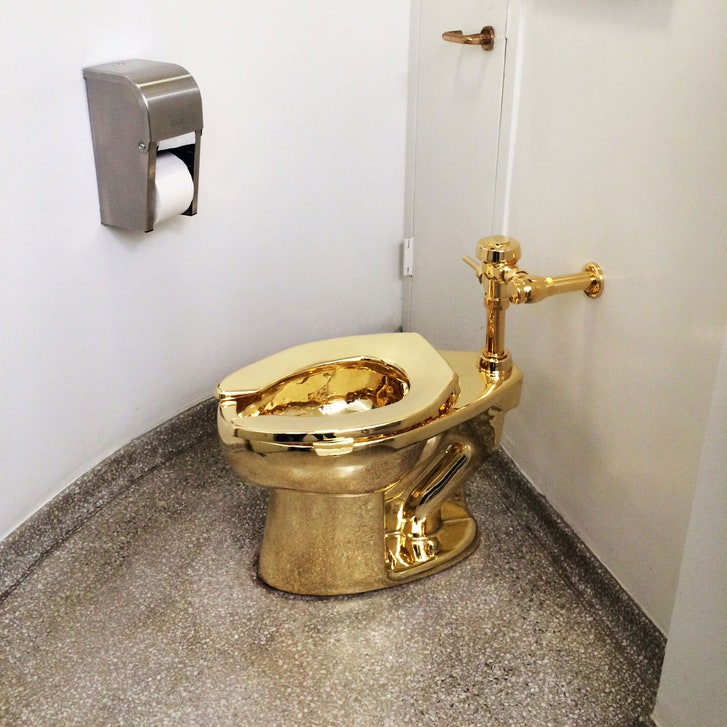
Where is `door`? The height and width of the screenshot is (727, 727). door is located at coordinates (462, 124).